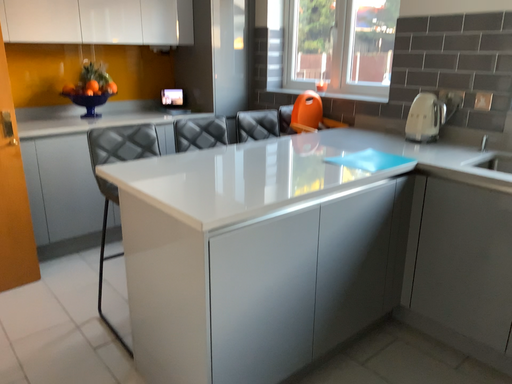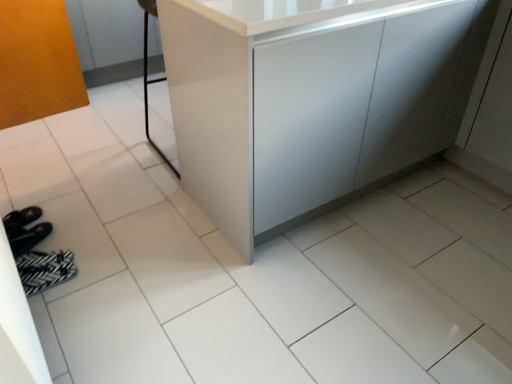
Question: How did the camera likely rotate when shooting the video?

Choices:
 (A) rotated right
 (B) rotated left

Answer: (B)